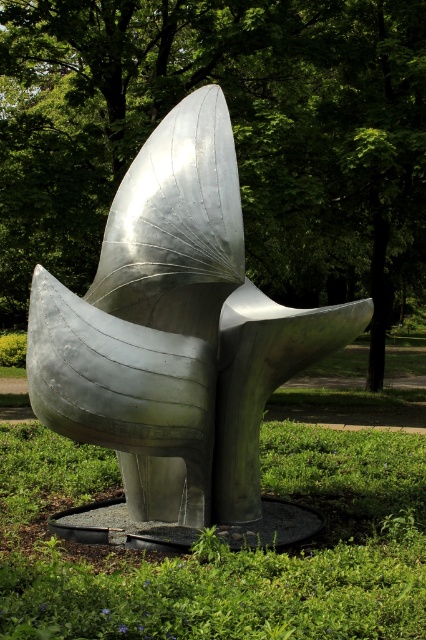
Which is in front, point (9, 148) or point (176, 104)?

Point (176, 104) is in front.

Where is `green leafy tree at center`? green leafy tree at center is located at coordinates (233, 132).

Does green leafy tree at center have a greater width compared to green grass at center?

Indeed, green leafy tree at center has a greater width compared to green grass at center.

Can you confirm if green leafy tree at center is thinner than green grass at center?

No.

Does point (255, 220) come behind point (302, 595)?

Yes, it is behind point (302, 595).

Identify the location of green leafy tree at center. The width and height of the screenshot is (426, 640). click(233, 132).

Which is more to the right, polished metal sculpture at center or green grass at center?

From the viewer's perspective, green grass at center appears more on the right side.

Can you confirm if polished metal sculpture at center is thinner than green grass at center?

Correct, polished metal sculpture at center's width is less than green grass at center's.

Is point (322, 320) positioned in front of point (394, 540)?

No, (322, 320) is behind (394, 540).

In order to click on polished metal sculpture at center in this screenshot , I will do `click(175, 332)`.